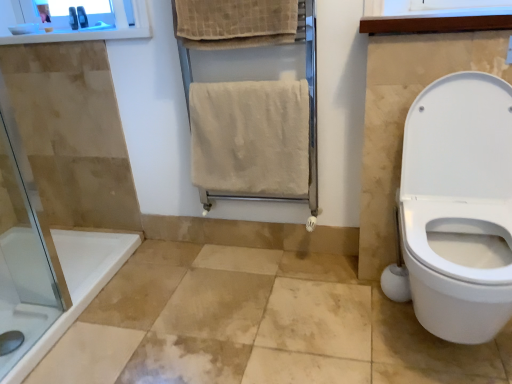
Find the location of a particular element. This screenshot has height=384, width=512. vacant region under beige towel rack at center (from a real-world perspective) is located at coordinates (253, 251).